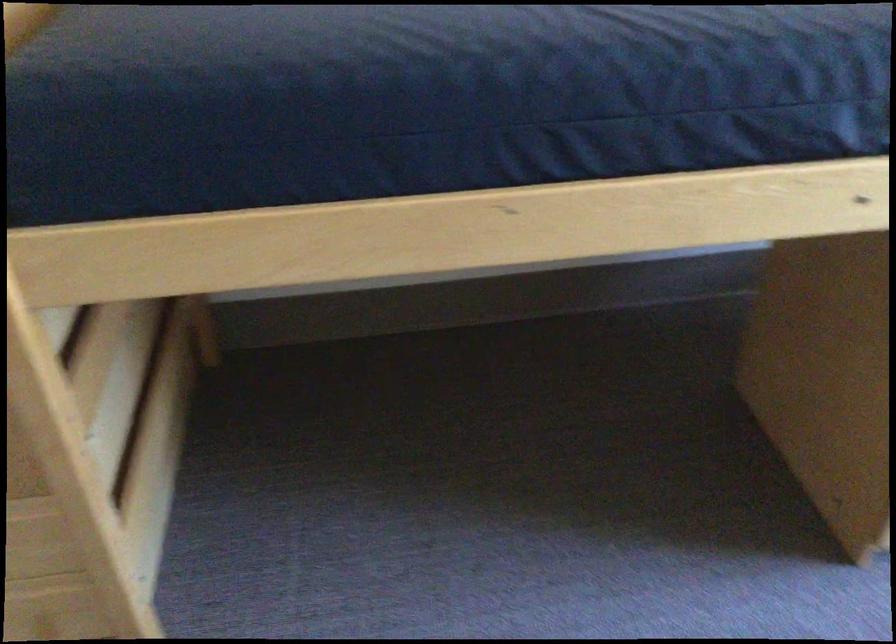
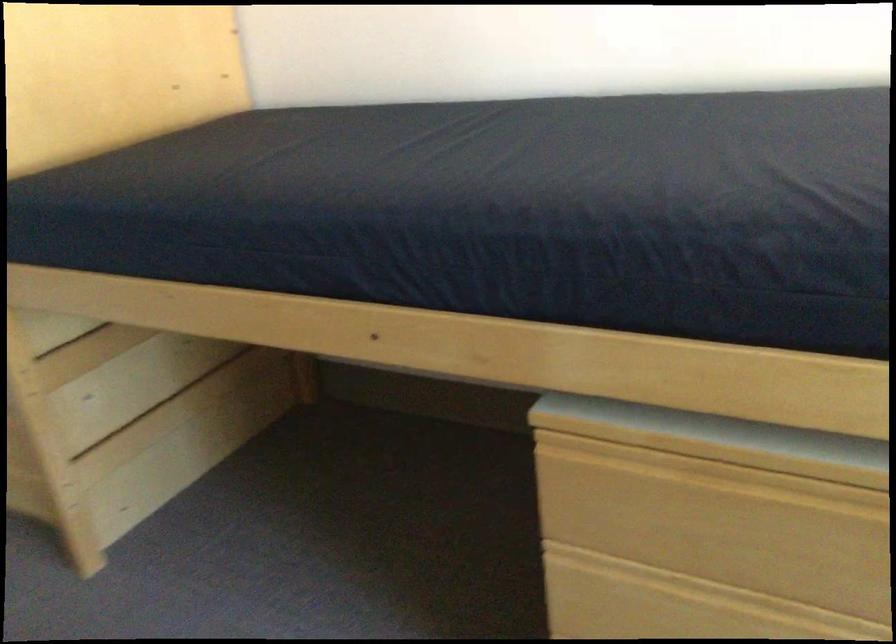
Where in the second image is the point corresponding to point (136, 494) from the first image?

(152, 458)